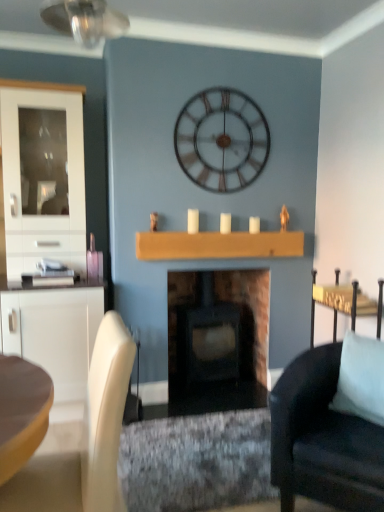
Question: From a real-world perspective, relative to white glossy cabinet at left, is metallic silver clock at upper center vertically above or below?

Choices:
 (A) above
 (B) below

Answer: (A)

Question: Is point (236, 190) closer or farther from the camera than point (34, 266)?

Choices:
 (A) farther
 (B) closer

Answer: (A)

Question: Estimate the real-world distances between objects in this image. Which object is closer to the metallic gold side table at right?

Choices:
 (A) wooden mantel at center
 (B) matte black wood-burning stove at center
 (C) black fabric chair at right
 (D) white glossy cabinet at left
 (E) light blue fabric pillow at right

Answer: (E)

Question: Which object is positioned farthest from the white matte candle at center, which appears as the 3th candle when viewed from the left?

Choices:
 (A) light blue fabric pillow at right
 (B) black fabric chair at right
 (C) white matte candle at center, the first candle when ordered from left to right
 (D) matte black wood-burning stove at center
 (E) wooden mantel at center

Answer: (B)